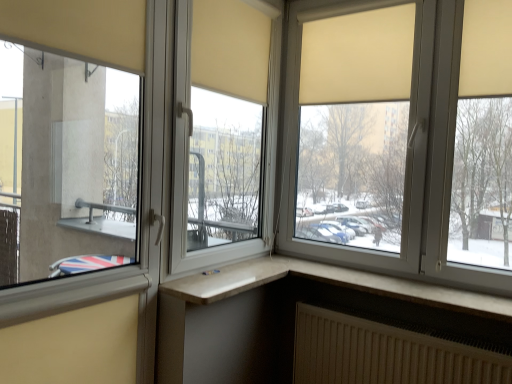
Question: Should I look upward or downward to see white textured radiator at lower right?

Choices:
 (A) down
 (B) up

Answer: (A)

Question: Is white textured radiator at lower right facing towards matte beige roller blind at upper right, which ranks as the 2th window in left-to-right order?

Choices:
 (A) yes
 (B) no

Answer: (B)

Question: From the image's perspective, is white textured radiator at lower right over matte beige roller blind at upper right, which ranks as the 2th window in left-to-right order?

Choices:
 (A) no
 (B) yes

Answer: (A)

Question: Are white textured radiator at lower right and matte beige roller blind at upper right, which ranks as the 2th window in left-to-right order, beside each other?

Choices:
 (A) no
 (B) yes

Answer: (A)

Question: From a real-world perspective, is white textured radiator at lower right on top of matte beige roller blind at upper right, placed as the 2th window when sorted from right to left?

Choices:
 (A) no
 (B) yes

Answer: (A)

Question: From the image's perspective, does white textured radiator at lower right appear lower than matte beige roller blind at upper right, which ranks as the 2th window in left-to-right order?

Choices:
 (A) yes
 (B) no

Answer: (A)

Question: From a real-world perspective, is white textured radiator at lower right below matte beige roller blind at upper right, which ranks as the 2th window in left-to-right order?

Choices:
 (A) no
 (B) yes

Answer: (B)

Question: Is matte beige roller blind at upper right, placed as the 2th window when sorted from right to left, closer to the viewer compared to white plastic window at lower right, marked as the third window in a left-to-right arrangement?

Choices:
 (A) no
 (B) yes

Answer: (A)

Question: Does matte beige roller blind at upper right, placed as the 2th window when sorted from right to left, have a larger size compared to white plastic window at lower right, the 1th window viewed from the right?

Choices:
 (A) yes
 (B) no

Answer: (A)

Question: Could you tell me if matte beige roller blind at upper right, placed as the 2th window when sorted from right to left, is turned towards white plastic window at lower right, marked as the third window in a left-to-right arrangement?

Choices:
 (A) no
 (B) yes

Answer: (A)

Question: From a real-world perspective, is matte beige roller blind at upper right, which ranks as the 2th window in left-to-right order, located beneath white plastic window at lower right, marked as the third window in a left-to-right arrangement?

Choices:
 (A) no
 (B) yes

Answer: (A)

Question: Is matte beige roller blind at upper right, placed as the 2th window when sorted from right to left, far away from white plastic window at lower right, the 1th window viewed from the right?

Choices:
 (A) no
 (B) yes

Answer: (A)

Question: Is matte beige roller blind at upper right, which ranks as the 2th window in left-to-right order, placed right next to white plastic window at lower right, the 1th window viewed from the right?

Choices:
 (A) no
 (B) yes

Answer: (A)

Question: Does matte glass window at left, arranged as the third window when viewed from the right, turn towards matte beige roller blind at upper right, placed as the 2th window when sorted from right to left?

Choices:
 (A) yes
 (B) no

Answer: (B)